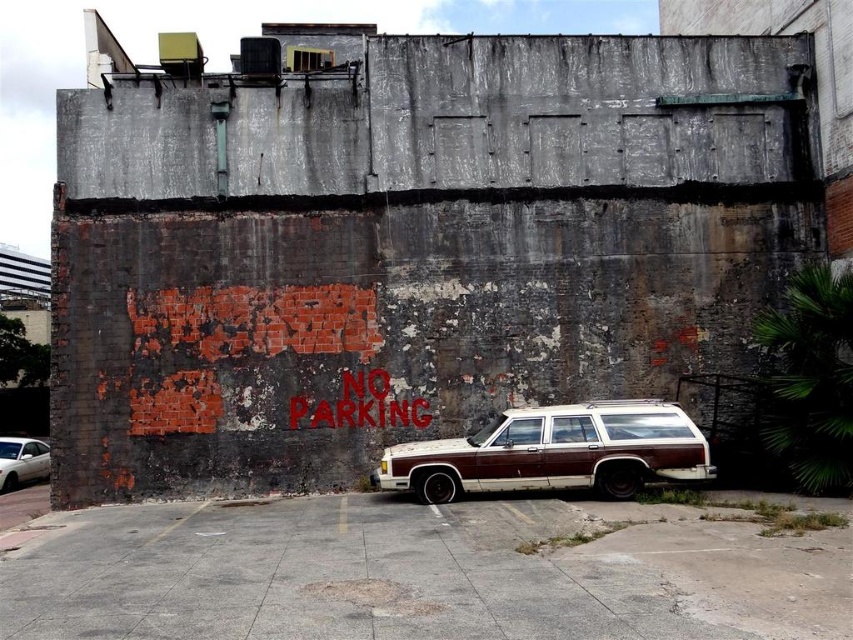
Question: Which object appears farthest from the camera in this image?

Choices:
 (A) rustic wood station wagon at center
 (B) white matte car at lower left

Answer: (B)

Question: In this image, where is rustic wood station wagon at center located relative to white matte car at lower left?

Choices:
 (A) above
 (B) below

Answer: (A)

Question: Can you confirm if rustic wood station wagon at center is smaller than white matte car at lower left?

Choices:
 (A) yes
 (B) no

Answer: (B)

Question: Among these objects, which one is farthest from the camera?

Choices:
 (A) white matte car at lower left
 (B) rustic wood station wagon at center

Answer: (A)

Question: Among these points, which one is farthest from the camera?

Choices:
 (A) (0, 465)
 (B) (573, 438)

Answer: (A)

Question: Is rustic wood station wagon at center above white matte car at lower left?

Choices:
 (A) yes
 (B) no

Answer: (A)